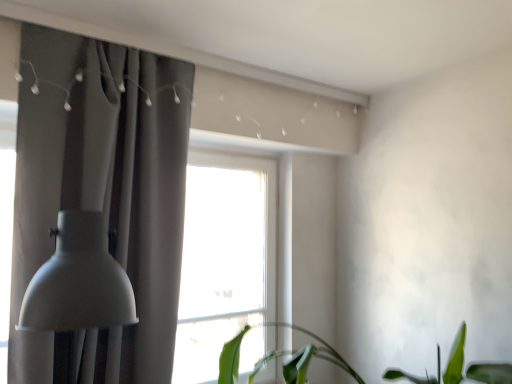
Question: From the image's perspective, would you say green leafy plant at lower center is positioned over matte gray curtain at left?

Choices:
 (A) yes
 (B) no

Answer: (B)

Question: From the image's perspective, is green leafy plant at lower center beneath matte gray curtain at left?

Choices:
 (A) yes
 (B) no

Answer: (A)

Question: Considering the relative sizes of green leafy plant at lower center and matte gray curtain at left in the image provided, is green leafy plant at lower center taller than matte gray curtain at left?

Choices:
 (A) no
 (B) yes

Answer: (A)

Question: Is green leafy plant at lower center turned away from matte gray curtain at left?

Choices:
 (A) yes
 (B) no

Answer: (B)

Question: Is green leafy plant at lower center surrounding matte gray curtain at left?

Choices:
 (A) no
 (B) yes

Answer: (A)

Question: From the image's perspective, relative to green leafy plant at lower center, is matte gray lampshade at left above or below?

Choices:
 (A) below
 (B) above

Answer: (B)

Question: In terms of width, does matte gray lampshade at left look wider or thinner when compared to green leafy plant at lower center?

Choices:
 (A) thin
 (B) wide

Answer: (A)

Question: Does point (135, 312) appear closer or farther from the camera than point (250, 380)?

Choices:
 (A) farther
 (B) closer

Answer: (B)

Question: Is matte gray lampshade at left taller or shorter than green leafy plant at lower center?

Choices:
 (A) short
 (B) tall

Answer: (B)

Question: Considering the positions of green leafy plant at lower center and matte gray curtain at left in the image, is green leafy plant at lower center bigger or smaller than matte gray curtain at left?

Choices:
 (A) big
 (B) small

Answer: (A)

Question: In the image, is green leafy plant at lower center positioned in front of or behind matte gray curtain at left?

Choices:
 (A) behind
 (B) front

Answer: (B)

Question: Visually, is green leafy plant at lower center positioned to the left or to the right of matte gray curtain at left?

Choices:
 (A) left
 (B) right

Answer: (B)

Question: Is green leafy plant at lower center wider or thinner than matte gray curtain at left?

Choices:
 (A) wide
 (B) thin

Answer: (A)

Question: From the image's perspective, is matte gray curtain at left positioned above or below green leafy plant at lower center?

Choices:
 (A) below
 (B) above

Answer: (B)

Question: Is matte gray curtain at left inside or outside of green leafy plant at lower center?

Choices:
 (A) outside
 (B) inside

Answer: (A)